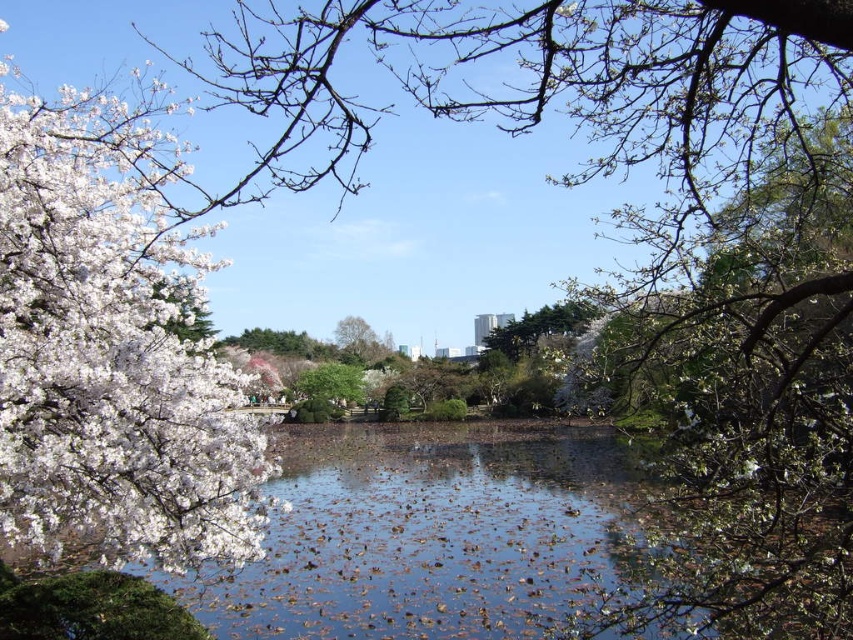
Does white matte flower at left have a greater height compared to green leafy tree at center?

Correct, white matte flower at left is much taller as green leafy tree at center.

Between white matte flower at left and green leafy tree at center, which one is positioned lower?

white matte flower at left

You are a GUI agent. You are given a task and a screenshot of the screen. Output one action in this format:
    pyautogui.click(x=<x>, y=<y>)
    Task: Click on the white matte flower at left
    The width and height of the screenshot is (853, 640).
    Given the screenshot: What is the action you would take?
    [x=112, y=349]